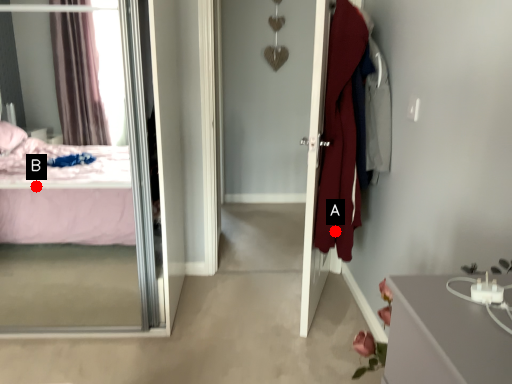
Question: Two points are circled on the image, labeled by A and B beside each circle. Which point appears closest to the camera in this image?

Choices:
 (A) A is closer
 (B) B is closer

Answer: (A)